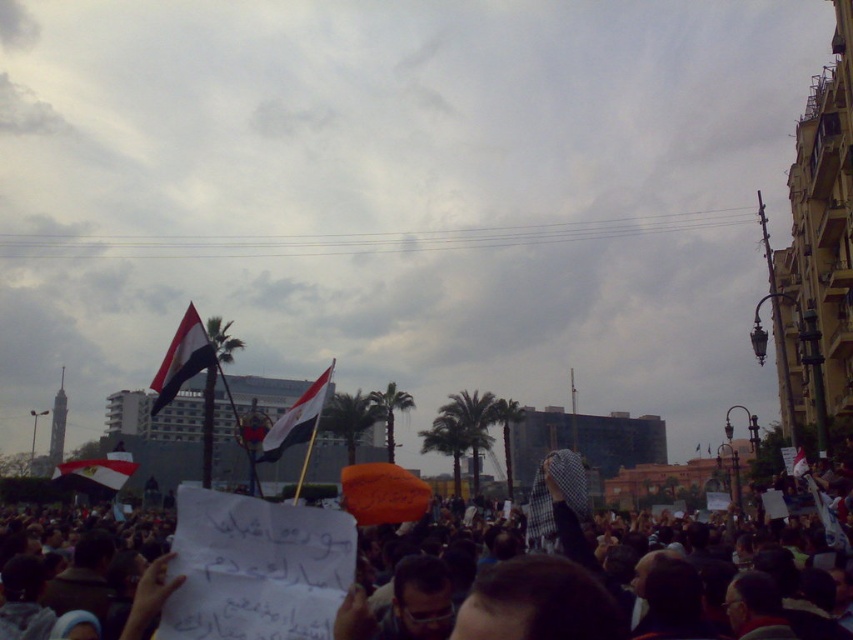
You are a photographer taking pictures of the protest in the square. You notice the white paper sign at lower center and the matte fabric flag at center. Which object is located to the right of the other?

The white paper sign at lower center is positioned on the right side of matte fabric flag at center.